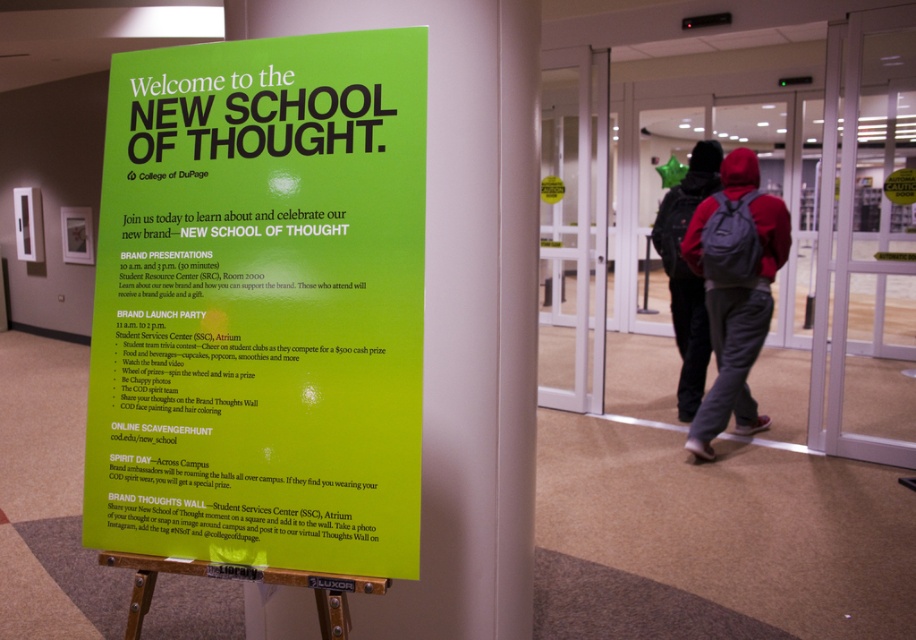
Question: Among these objects, which one is nearest to the camera?

Choices:
 (A) green paper sign at center
 (B) dark gray backpack at center
 (C) red fleece hoodie at center

Answer: (A)

Question: Can you confirm if green paper sign at center is wider than red fleece hoodie at center?

Choices:
 (A) yes
 (B) no

Answer: (A)

Question: Does red fleece hoodie at center come behind dark gray backpack at center?

Choices:
 (A) yes
 (B) no

Answer: (B)

Question: Among these points, which one is nearest to the camera?

Choices:
 (A) [685, 369]
 (B) [329, 417]

Answer: (B)

Question: Among these points, which one is nearest to the camera?

Choices:
 (A) (401, 456)
 (B) (672, 211)
 (C) (738, 301)

Answer: (A)

Question: Is green paper sign at center to the left of dark gray backpack at center from the viewer's perspective?

Choices:
 (A) no
 (B) yes

Answer: (B)